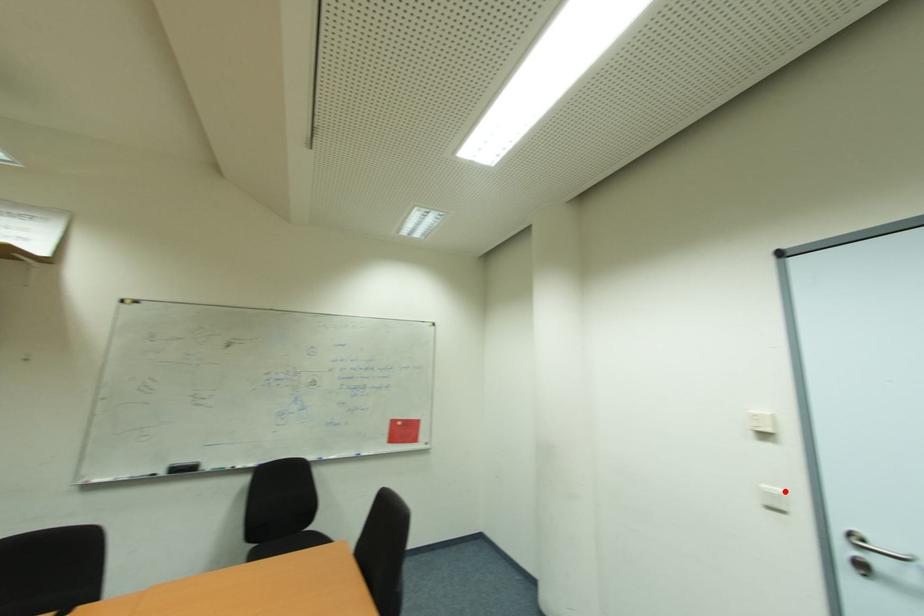
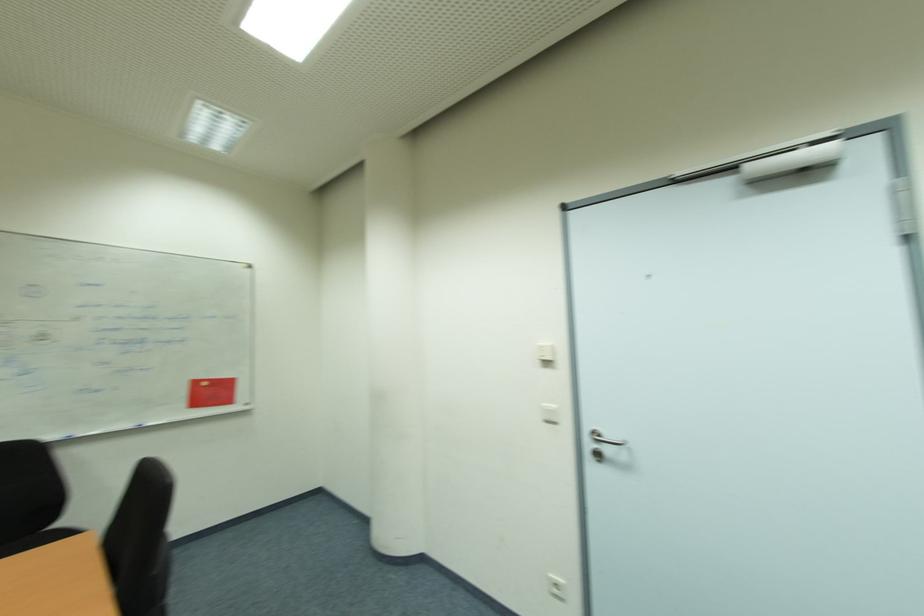
Question: I am providing you with two images of the same scene from different viewpoints. Given a red point in image1, look at the same physical point in image2. Is it:

Choices:
 (A) Closer to the viewpoint
 (B) Farther from the viewpoint

Answer: (B)